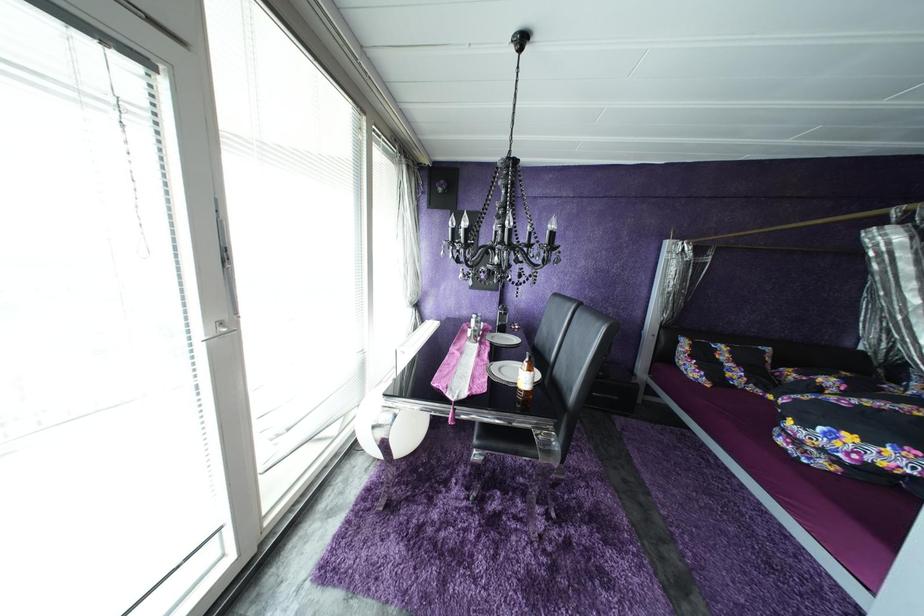
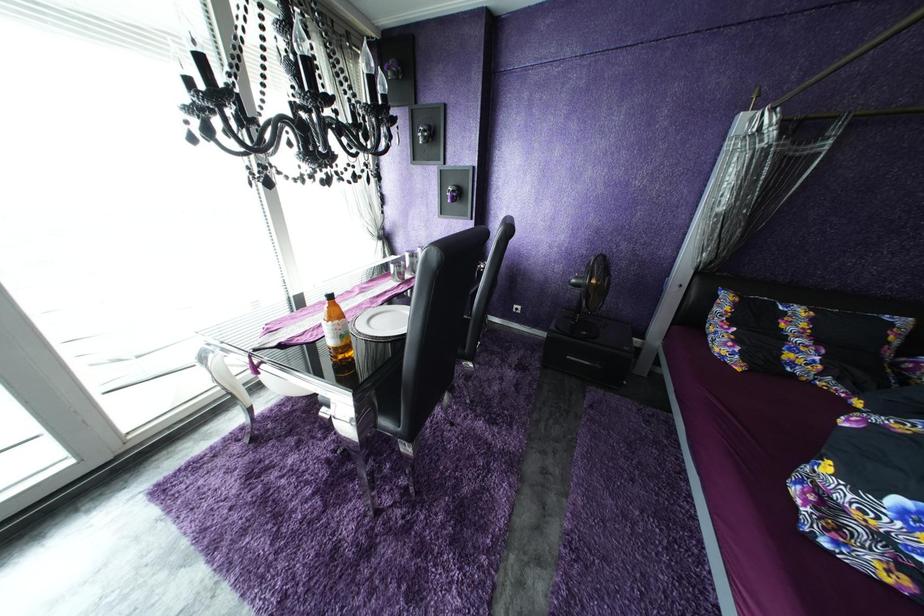
What movement of the cameraman would produce the second image?

The movement direction of the cameraman is right, forward.